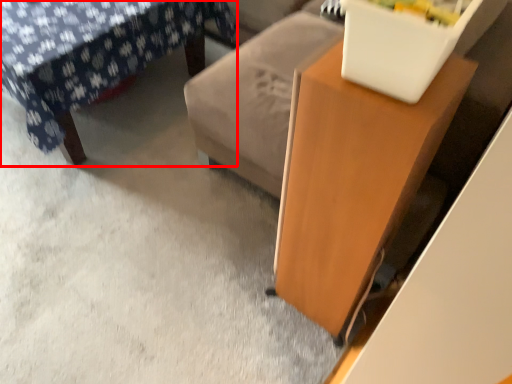
Question: From the image's perspective, what is the correct spatial positioning of furniture (annotated by the red box) in reference to table?

Choices:
 (A) below
 (B) above

Answer: (B)